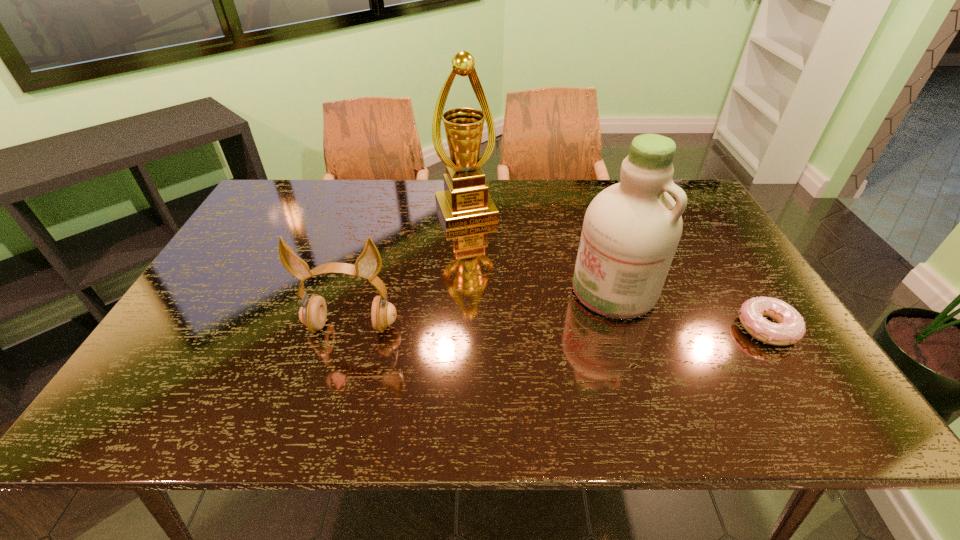
I want to click on free space at the far edge of the desktop, so click(x=588, y=180).

The width and height of the screenshot is (960, 540). Identify the location of free region at the near edge of the desktop. (270, 352).

Identify the location of vacant space at the left edge. (261, 260).

Where is `free location at the right edge of the desktop`? free location at the right edge of the desktop is located at coordinates (718, 238).

I want to click on vacant area at the far left corner of the desktop, so click(x=299, y=210).

The width and height of the screenshot is (960, 540). In order to click on vacant region at the near left corner of the desktop in this screenshot , I will do `click(193, 364)`.

In the image, there is a desktop. In order to click on free space at the near right corner in this screenshot , I will do `click(799, 368)`.

I want to click on vacant space that is in between the cleansing agent and the shortest object, so click(690, 309).

Find the location of a particular element. The height and width of the screenshot is (540, 960). vacant region between the third tallest object and the third shortest object is located at coordinates (483, 308).

Image resolution: width=960 pixels, height=540 pixels. I want to click on vacant point located between the cleansing agent and the second shortest object, so click(x=483, y=308).